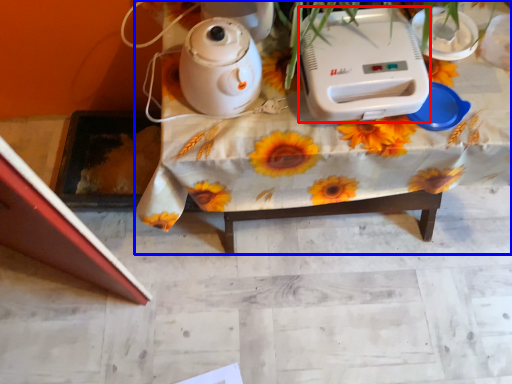
Question: Which object appears closest to the camera in this image, appliance (highlighted by a red box) or table (highlighted by a blue box)?

Choices:
 (A) appliance
 (B) table

Answer: (A)